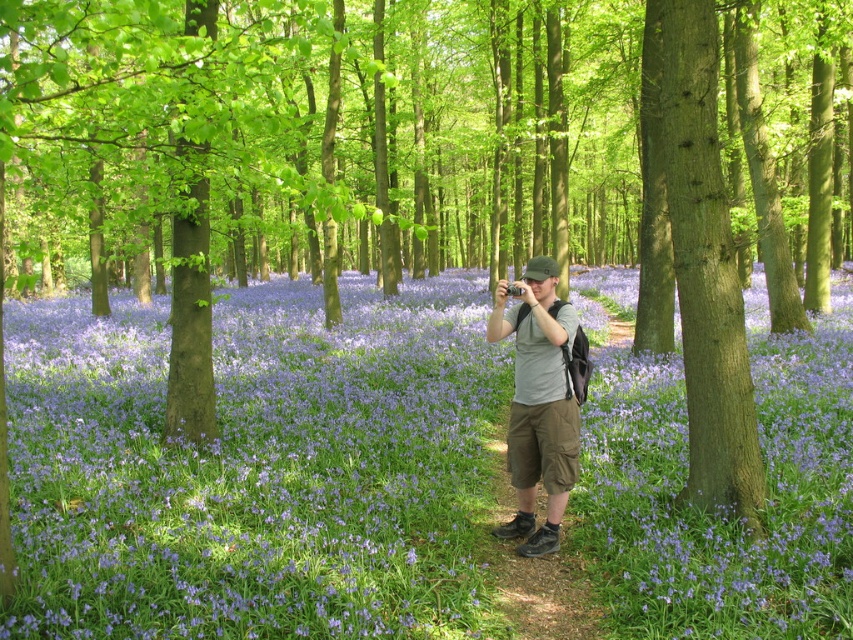
Question: Which of the following is the farthest from the observer?

Choices:
 (A) (527, 545)
 (B) (688, 600)

Answer: (A)

Question: Which point is farther to the camera?

Choices:
 (A) purple matte flower at center
 (B) smooth brown tree trunk at center

Answer: (B)

Question: Does purple matte flower at center appear on the left side of smooth brown tree trunk at center?

Choices:
 (A) yes
 (B) no

Answer: (A)

Question: Which point is farther to the camera?

Choices:
 (A) (548, 328)
 (B) (817, 541)
 (C) (724, 296)

Answer: (C)

Question: Can you confirm if purple matte flower at center is positioned to the right of matte gray t-shirt at center?

Choices:
 (A) no
 (B) yes

Answer: (B)

Question: Is purple matte flower at center thinner than smooth brown tree trunk at center?

Choices:
 (A) yes
 (B) no

Answer: (B)